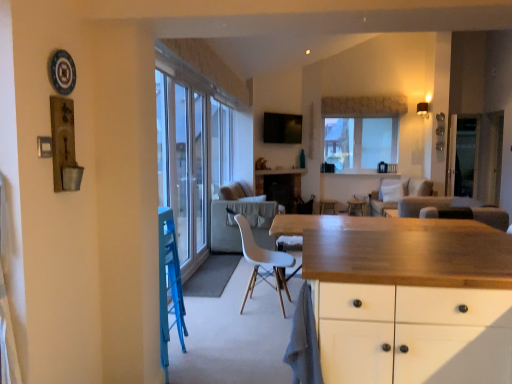
Question: Looking at their shapes, would you say dark brown leather armchair at center is wider or thinner than beige fabric couch at center, the first couch positioned from the back?

Choices:
 (A) thin
 (B) wide

Answer: (A)

Question: Considering the positions of dark brown leather armchair at center and beige fabric couch at center, the first couch positioned from the back, in the image, is dark brown leather armchair at center taller or shorter than beige fabric couch at center, the first couch positioned from the back,?

Choices:
 (A) short
 (B) tall

Answer: (A)

Question: Which of these objects is positioned farthest from the light gray fabric couch at center, which is the first couch from front to back?

Choices:
 (A) wooden table at center
 (B) textured beige curtain at upper center
 (C) clear glass window at upper center
 (D) white plastic chair at center
 (E) wooden bar stool at center

Answer: (D)

Question: Which object is positioned farthest from the clear glass window at upper center?

Choices:
 (A) wooden countertop at center
 (B) transparent glass screen door at center
 (C) textured beige curtain at upper center
 (D) wooden countertop at center
 (E) wooden table at center

Answer: (B)